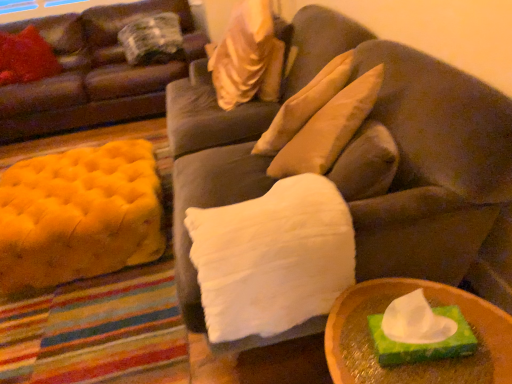
Question: Which direction should I rotate to face satin beige pillow at upper center, marked as the 2th pillow in a front-to-back arrangement, — up or down?

Choices:
 (A) down
 (B) up

Answer: (B)

Question: Does velvet brown couch at upper left, which is the second studio couch from front to back, have a larger size compared to satin beige pillow at upper center, positioned as the 3th pillow in left-to-right order?

Choices:
 (A) yes
 (B) no

Answer: (A)

Question: Is satin beige pillow at upper center, which is the 2th pillow in right-to-left order, completely or partially inside velvet brown couch at upper left, placed as the first studio couch when sorted from left to right?

Choices:
 (A) yes
 (B) no

Answer: (B)

Question: Does velvet brown couch at upper left, the 1th studio couch positioned from the back, appear on the left side of satin beige pillow at upper center, which is counted as the 3th pillow, starting from the back?

Choices:
 (A) no
 (B) yes

Answer: (B)

Question: Could you tell me if velvet brown couch at upper left, placed as the first studio couch when sorted from left to right, is turned towards satin beige pillow at upper center, marked as the 2th pillow in a front-to-back arrangement?

Choices:
 (A) yes
 (B) no

Answer: (A)

Question: Is velvet brown couch at upper left, which is the 2th studio couch in right-to-left order, positioned in front of satin beige pillow at upper center, marked as the 2th pillow in a front-to-back arrangement?

Choices:
 (A) yes
 (B) no

Answer: (B)

Question: From a real-world perspective, is velvet brown couch at upper left, the 1th studio couch positioned from the back, located higher than satin beige pillow at upper center, positioned as the 3th pillow in left-to-right order?

Choices:
 (A) yes
 (B) no

Answer: (B)

Question: Does velvet brown couch at upper left, which is the 2th studio couch in right-to-left order, touch velvety red pillow at upper left, which is the fourth pillow in right-to-left order?

Choices:
 (A) yes
 (B) no

Answer: (B)

Question: Is velvet brown couch at upper left, placed as the first studio couch when sorted from left to right, looking in the opposite direction of velvety red pillow at upper left, the second pillow in the back-to-front sequence?

Choices:
 (A) no
 (B) yes

Answer: (B)

Question: Is velvet brown couch at upper left, placed as the first studio couch when sorted from left to right, smaller than velvety red pillow at upper left, the second pillow in the back-to-front sequence?

Choices:
 (A) yes
 (B) no

Answer: (B)

Question: From a real-world perspective, is velvet brown couch at upper left, which is the 2th studio couch in right-to-left order, on top of velvety red pillow at upper left, marked as the 1th pillow in a left-to-right arrangement?

Choices:
 (A) yes
 (B) no

Answer: (B)

Question: Can you confirm if velvet brown couch at upper left, which is the second studio couch from front to back, is shorter than velvety red pillow at upper left, which is counted as the 3th pillow, starting from the front?

Choices:
 (A) no
 (B) yes

Answer: (A)

Question: From the image's perspective, is velvet brown couch at upper left, which is the second studio couch from front to back, located beneath velvety red pillow at upper left, the second pillow in the back-to-front sequence?

Choices:
 (A) yes
 (B) no

Answer: (A)

Question: From a real-world perspective, is wooden tray at lower right positioned under plaid fabric pillow at upper left, which is the second pillow from left to right, based on gravity?

Choices:
 (A) yes
 (B) no

Answer: (A)